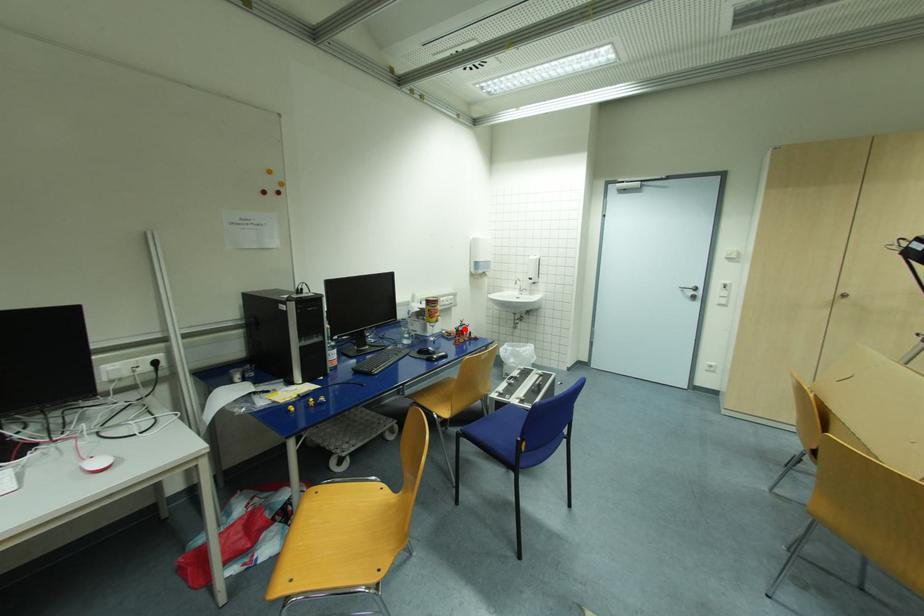
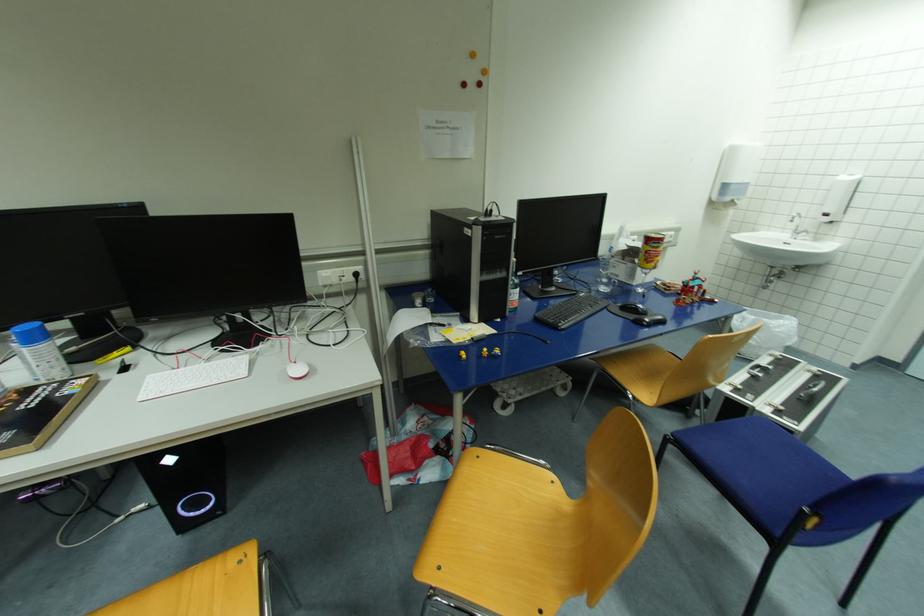
Find the pixel in the second image that matches the highlighted location in the first image.

(696, 285)